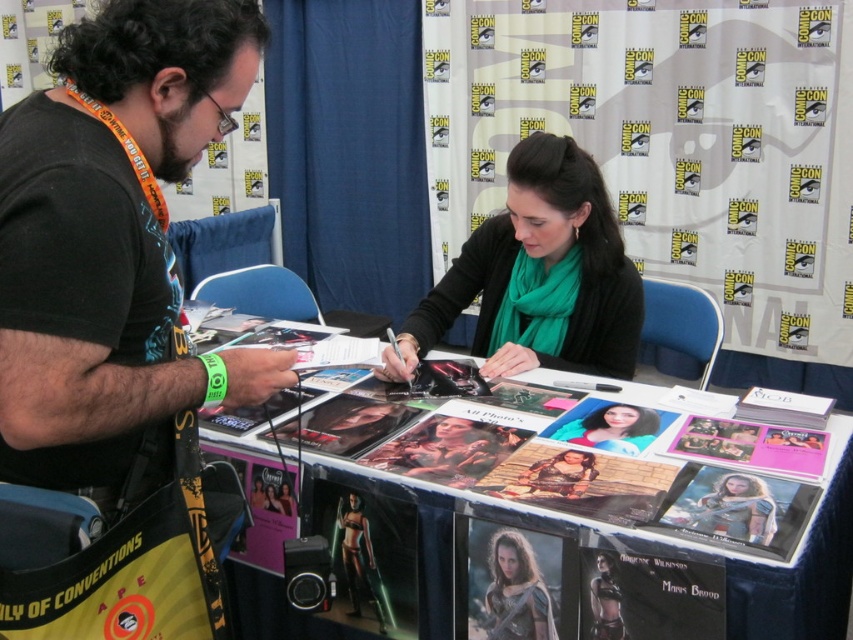
You are a photographer at the Comic Con event. You need to arrange two items on a display table for a photo shoot. The items are the metallic silver photo at center and the smooth skin portrait at center. According to the scene, which item should be placed to the left of the other?

The smooth skin portrait at center should be placed to the left of the metallic silver photo at center because the metallic silver photo at center is positioned on the right side of the smooth skin portrait at center.

Based on the provided scene description, where is the metallic silver photo at center located in terms of its 2D coordinates?

The metallic silver photo at center is located at the 2D coordinates point (799, 577).

You are at a comic convention and see two items on the table in front of you. One is a metallic silver photo at center and the other is a metallic armor at center. Which item takes up more space on the table?

The metallic silver photo at center is bigger than the metallic armor at center, so it takes up more space on the table.